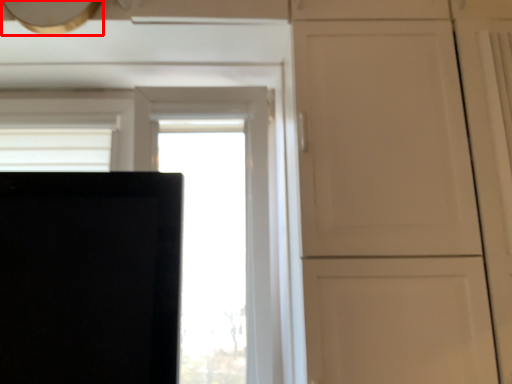
Question: From the image's perspective, where is exhaust hood (annotated by the red box) located in relation to window in the image?

Choices:
 (A) below
 (B) above

Answer: (B)